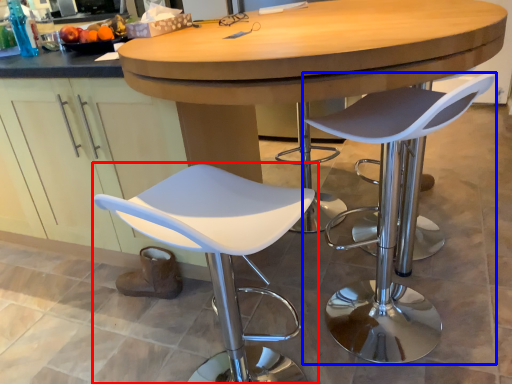
Question: Which object appears closest to the camera in this image, chair (highlighted by a red box) or chair (highlighted by a blue box)?

Choices:
 (A) chair
 (B) chair

Answer: (A)